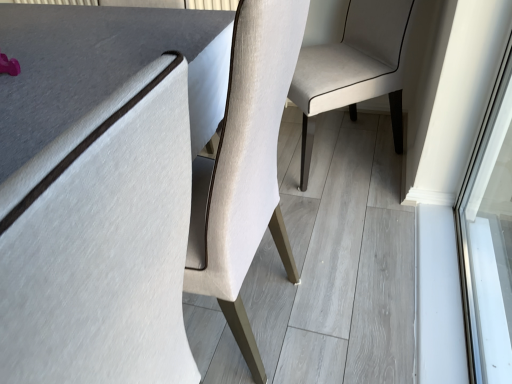
Question: From the image's perspective, is matte gray table at center on top of light beige fabric chair at center?

Choices:
 (A) yes
 (B) no

Answer: (B)

Question: From a real-world perspective, is matte gray table at center physically below light beige fabric chair at center?

Choices:
 (A) no
 (B) yes

Answer: (A)

Question: Does matte gray table at center touch light beige fabric chair at center?

Choices:
 (A) yes
 (B) no

Answer: (B)

Question: Is matte gray table at center oriented towards light beige fabric chair at center?

Choices:
 (A) yes
 (B) no

Answer: (B)

Question: Is light beige fabric chair at center completely or partially inside matte gray table at center?

Choices:
 (A) yes
 (B) no

Answer: (B)

Question: Can you confirm if matte gray table at center is shorter than light beige fabric chair at center?

Choices:
 (A) no
 (B) yes

Answer: (A)

Question: Is light beige fabric chair at center to the right of matte gray table at center from the viewer's perspective?

Choices:
 (A) yes
 (B) no

Answer: (A)

Question: Does light beige fabric chair at center lie behind matte gray table at center?

Choices:
 (A) yes
 (B) no

Answer: (A)

Question: Is light beige fabric chair at center facing away from matte gray table at center?

Choices:
 (A) yes
 (B) no

Answer: (B)

Question: Can you confirm if light beige fabric chair at center is wider than matte gray table at center?

Choices:
 (A) yes
 (B) no

Answer: (A)

Question: Can you confirm if light beige fabric chair at center is smaller than matte gray table at center?

Choices:
 (A) yes
 (B) no

Answer: (B)

Question: Can you confirm if light beige fabric chair at center is taller than matte gray table at center?

Choices:
 (A) no
 (B) yes

Answer: (A)

Question: From a real-world perspective, relative to light beige fabric chair at center, is matte gray table at center vertically above or below?

Choices:
 (A) above
 (B) below

Answer: (A)